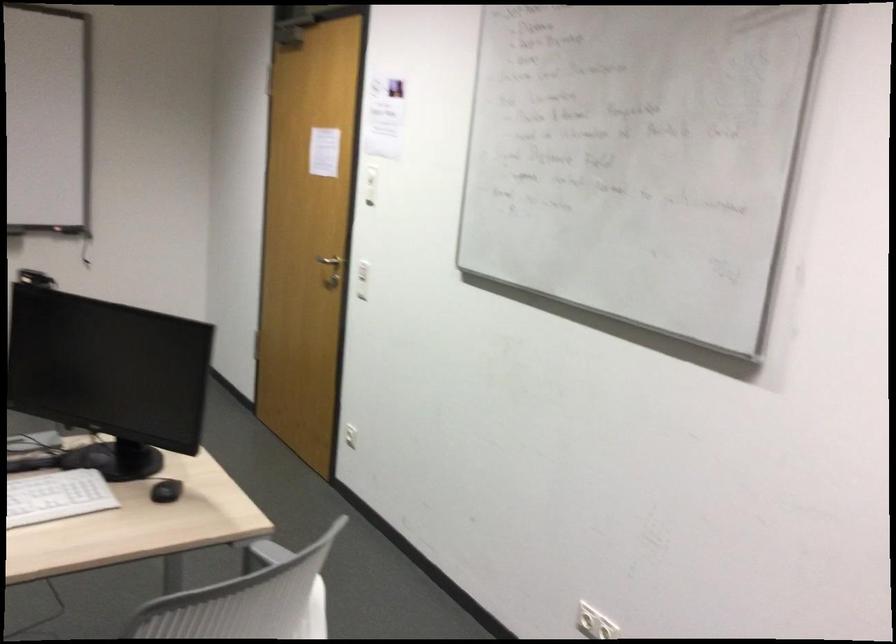
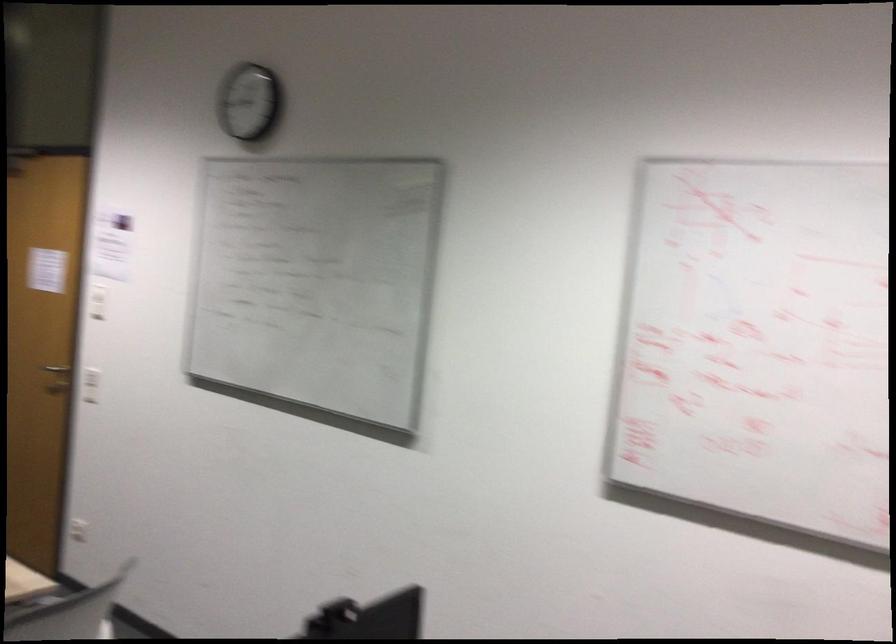
In the second image, find the point that corresponds to (x=343, y=270) in the first image.

(90, 384)